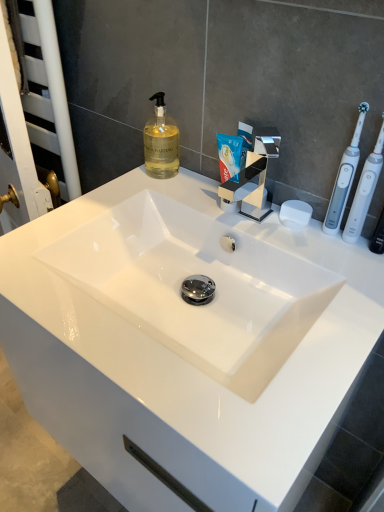
This screenshot has width=384, height=512. Identify the location of vacant space that's between translucent glass soap dispenser at upper center and white matte soap at right. [210, 194].